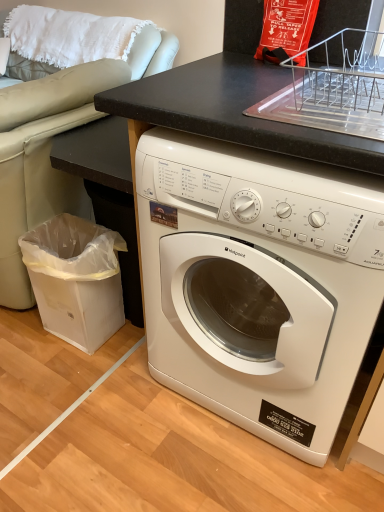
Question: From the image's perspective, would you say white glossy washing machine at center is positioned over transparent plastic trash can at lower left?

Choices:
 (A) yes
 (B) no

Answer: (A)

Question: Considering the relative sizes of white glossy washing machine at center and transparent plastic trash can at lower left in the image provided, is white glossy washing machine at center taller than transparent plastic trash can at lower left?

Choices:
 (A) no
 (B) yes

Answer: (B)

Question: Considering the relative positions of white glossy washing machine at center and transparent plastic trash can at lower left in the image provided, is white glossy washing machine at center to the right of transparent plastic trash can at lower left from the viewer's perspective?

Choices:
 (A) yes
 (B) no

Answer: (A)

Question: Is white glossy washing machine at center positioned before transparent plastic trash can at lower left?

Choices:
 (A) no
 (B) yes

Answer: (B)

Question: Is the depth of white glossy washing machine at center greater than that of transparent plastic trash can at lower left?

Choices:
 (A) no
 (B) yes

Answer: (A)

Question: Is white glossy washing machine at center facing towards transparent plastic trash can at lower left?

Choices:
 (A) yes
 (B) no

Answer: (B)

Question: Can you confirm if transparent plastic trash can at lower left is wider than white glossy washing machine at center?

Choices:
 (A) yes
 (B) no

Answer: (B)

Question: Does transparent plastic trash can at lower left touch white glossy washing machine at center?

Choices:
 (A) no
 (B) yes

Answer: (A)

Question: From the image's perspective, is transparent plastic trash can at lower left over white glossy washing machine at center?

Choices:
 (A) yes
 (B) no

Answer: (B)

Question: Can you confirm if transparent plastic trash can at lower left is shorter than white glossy washing machine at center?

Choices:
 (A) no
 (B) yes

Answer: (B)

Question: From a real-world perspective, is transparent plastic trash can at lower left on white glossy washing machine at center?

Choices:
 (A) no
 (B) yes

Answer: (A)

Question: Considering the relative positions of transparent plastic trash can at lower left and white glossy washing machine at center in the image provided, is transparent plastic trash can at lower left behind white glossy washing machine at center?

Choices:
 (A) yes
 (B) no

Answer: (A)

Question: Visually, is transparent plastic trash can at lower left positioned to the left or to the right of white glossy washing machine at center?

Choices:
 (A) right
 (B) left

Answer: (B)